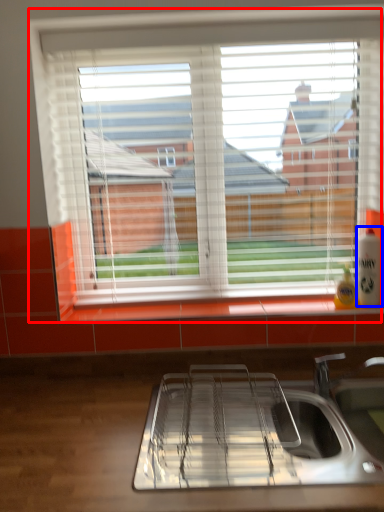
Question: Which object appears closest to the camera in this image, window (highlighted by a red box) or beverage (highlighted by a blue box)?

Choices:
 (A) window
 (B) beverage

Answer: (A)